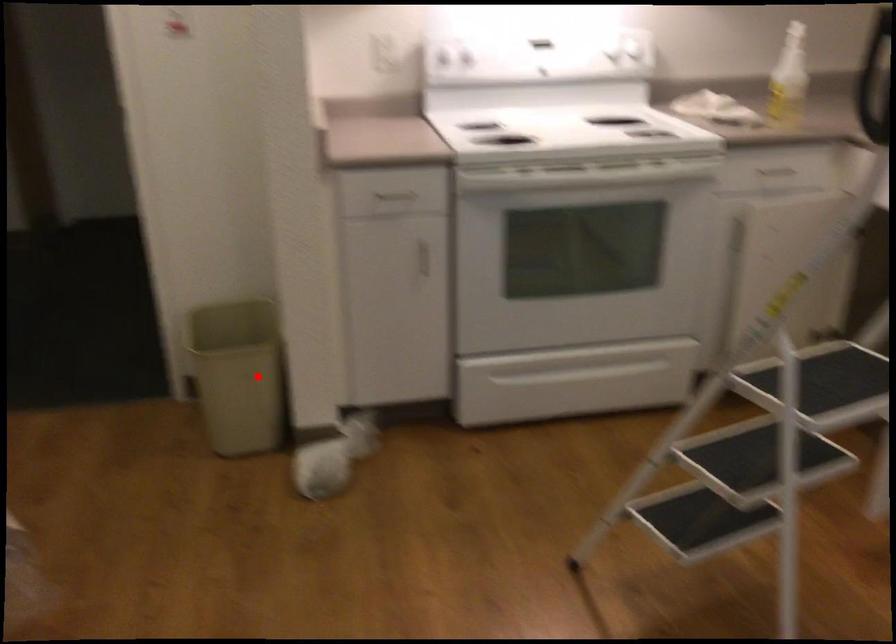
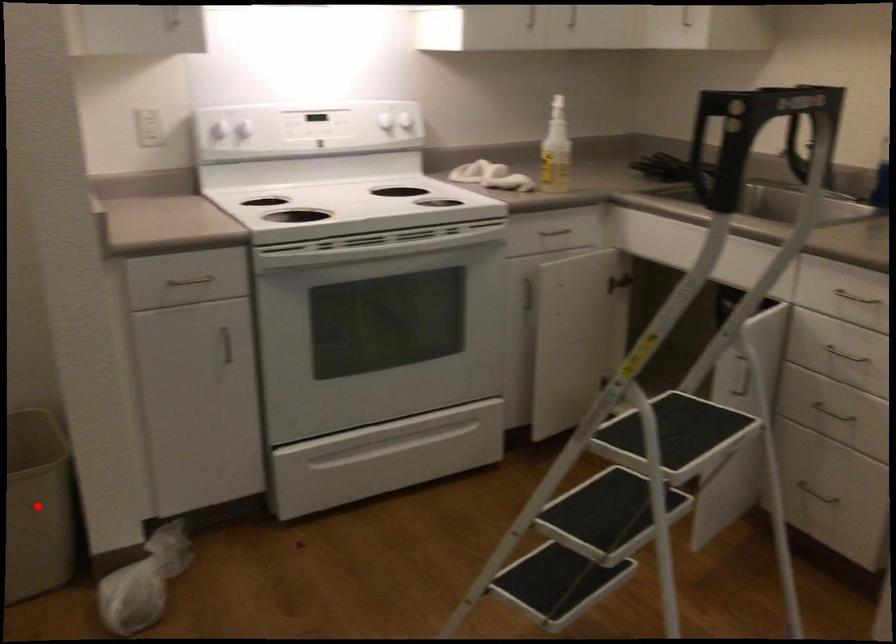
I am providing you with two images of the same scene from different viewpoints. A red point is marked on the first image and another point is marked on the second image. Does the point marked in image1 correspond to the same location as the one in image2?

Yes